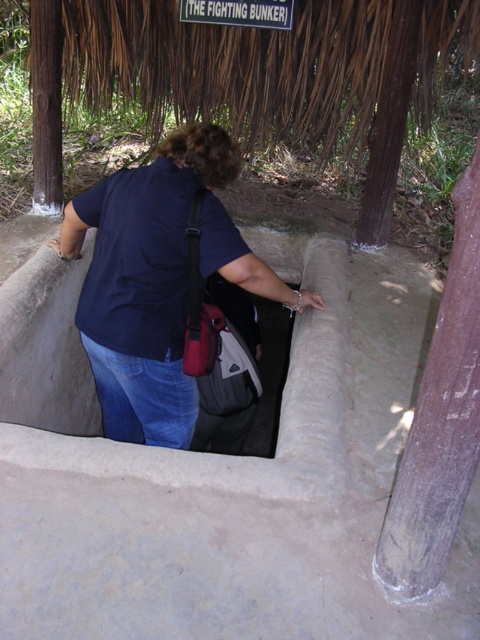
Consider the image. You are a construction worker who needs to enter the gray concrete trench at center. You are wearing the dark blue shirt at center. The safety regulations require that your head must be at least 1.5 meters below the trench edge to avoid exposure to falling debris. Can you safely enter the trench while complying with this regulation?

The gray concrete trench at center has a greater height compared to dark blue shirt at center. Since the trench is taller than the shirt, it is possible to enter while keeping your head 1.5 meters below the edge as required by safety regulations.

You are a park ranger assessing the safety of the area. You see the gray concrete trench at center and the dark blue shirt at center. Which object is bigger?

The gray concrete trench at center is larger in size than the dark blue shirt at center.

Based on the photo, you are a soldier preparing to crawl through the gray concrete trench at center. Your uniform includes the dark blue shirt at center. Can your uniform fit through the trench without getting damaged if the trench is wider than your uniform?

The gray concrete trench at center might be wider than dark blue shirt at center. Since the trench is possibly wider, your uniform including the dark blue shirt at center should fit through without damage as there would be enough space.